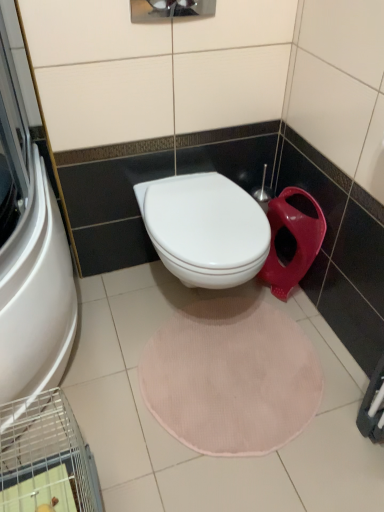
Measure the distance between point (190,396) and camera.

Point (190,396) is 4.26 feet away from camera.

Describe the element at coordinates (231, 377) in the screenshot. I see `pink fabric bath mat at center` at that location.

In order to face pink fabric bath mat at center, should I rotate leftwards or rightwards?

You should rotate right by 4.910 degrees.

Locate an element on the screen. This screenshot has width=384, height=512. pink fabric bath mat at center is located at coordinates (231, 377).

Identify the location of pink fabric bath mat at center. The image size is (384, 512). [x=231, y=377].